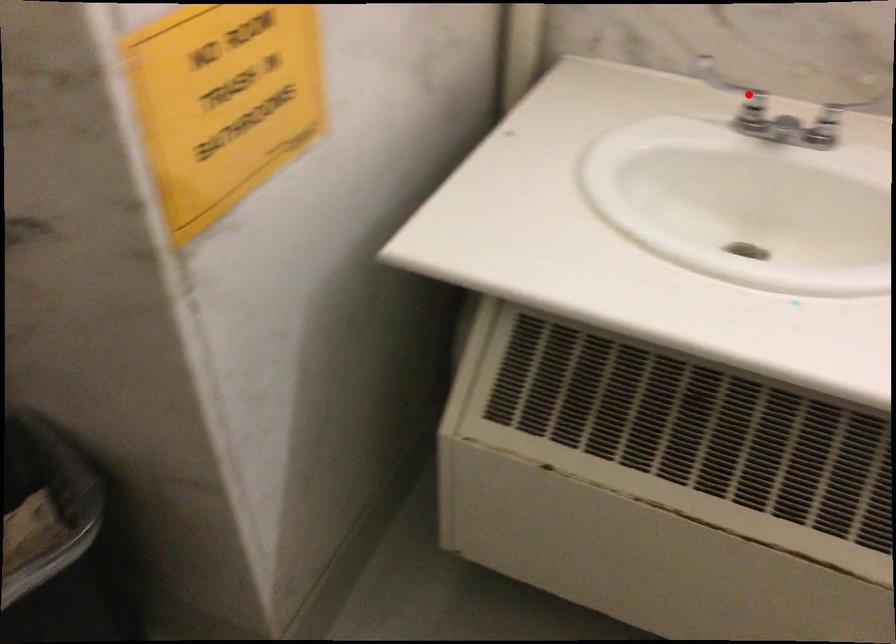
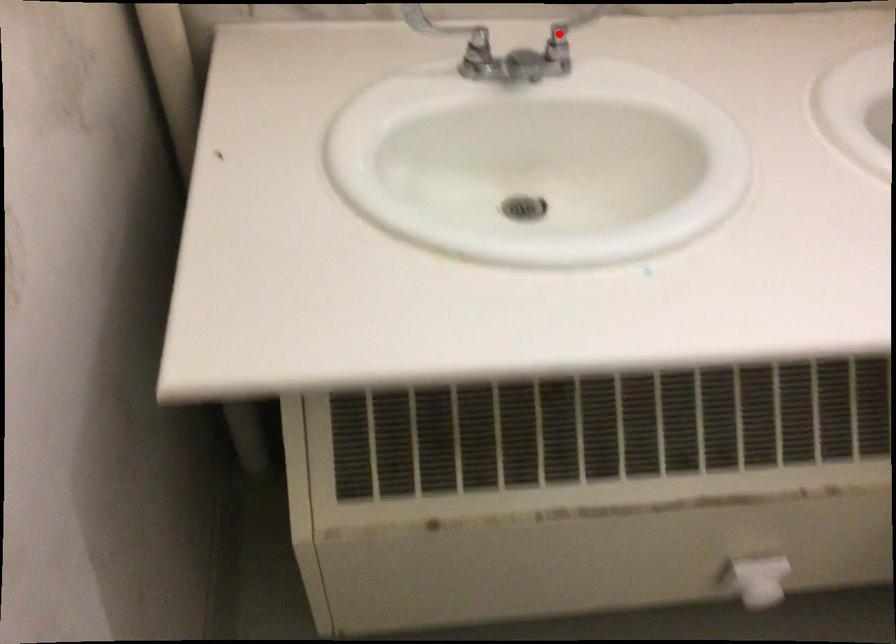
I am providing you with two images of the same scene from different viewpoints. A red point is marked on the first image and another point is marked on the second image. Does the point marked in image1 correspond to the same location as the one in image2?

No